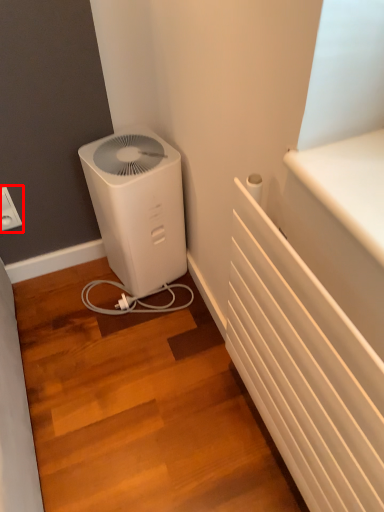
Question: From the image's perspective, where is electric outlet (annotated by the red box) located in relation to home appliance in the image?

Choices:
 (A) below
 (B) above

Answer: (B)